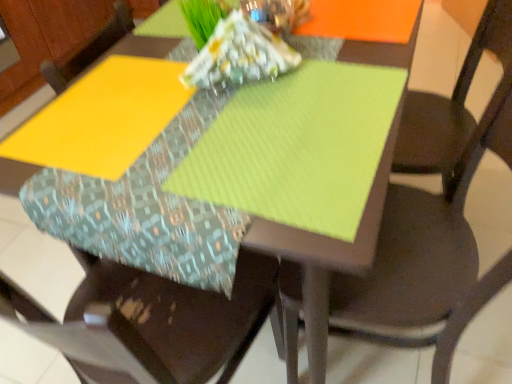
Question: Considering the positions of matte brown chair at center, the 2th chair from the left, and fabric cushion at center, the 1th chair in the left-to-right sequence, in the image, is matte brown chair at center, the 2th chair from the left, taller or shorter than fabric cushion at center, the 1th chair in the left-to-right sequence,?

Choices:
 (A) tall
 (B) short

Answer: (B)

Question: Is matte brown chair at center, which ranks as the 1th chair in right-to-left order, wider or thinner than fabric cushion at center, placed as the second chair when sorted from right to left?

Choices:
 (A) wide
 (B) thin

Answer: (A)

Question: From a real-world perspective, relative to fabric cushion at center, placed as the second chair when sorted from right to left, is matte brown chair at center, the 2th chair from the left, vertically above or below?

Choices:
 (A) below
 (B) above

Answer: (B)

Question: Would you say fabric cushion at center, placed as the second chair when sorted from right to left, is to the left or to the right of matte brown chair at center, which ranks as the 1th chair in right-to-left order, in the picture?

Choices:
 (A) left
 (B) right

Answer: (A)

Question: Considering the positions of point (84, 375) and point (384, 288), is point (84, 375) closer or farther from the camera than point (384, 288)?

Choices:
 (A) closer
 (B) farther

Answer: (B)

Question: From the image's perspective, is fabric cushion at center, placed as the second chair when sorted from right to left, above or below matte brown chair at center, the 2th chair from the left?

Choices:
 (A) above
 (B) below

Answer: (B)

Question: Is fabric cushion at center, placed as the second chair when sorted from right to left, inside the boundaries of matte brown chair at center, the 2th chair from the left, or outside?

Choices:
 (A) inside
 (B) outside

Answer: (B)